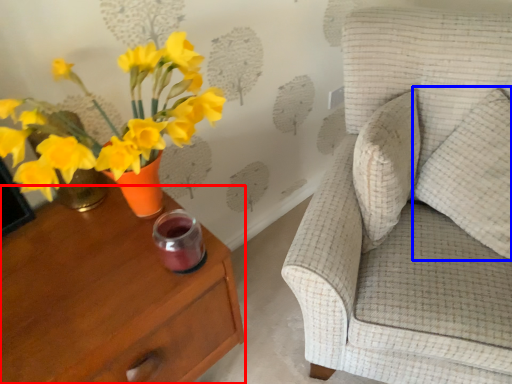
Question: Which object is closer to the camera taking this photo, nightstand (highlighted by a red box) or pillow (highlighted by a blue box)?

Choices:
 (A) nightstand
 (B) pillow

Answer: (A)